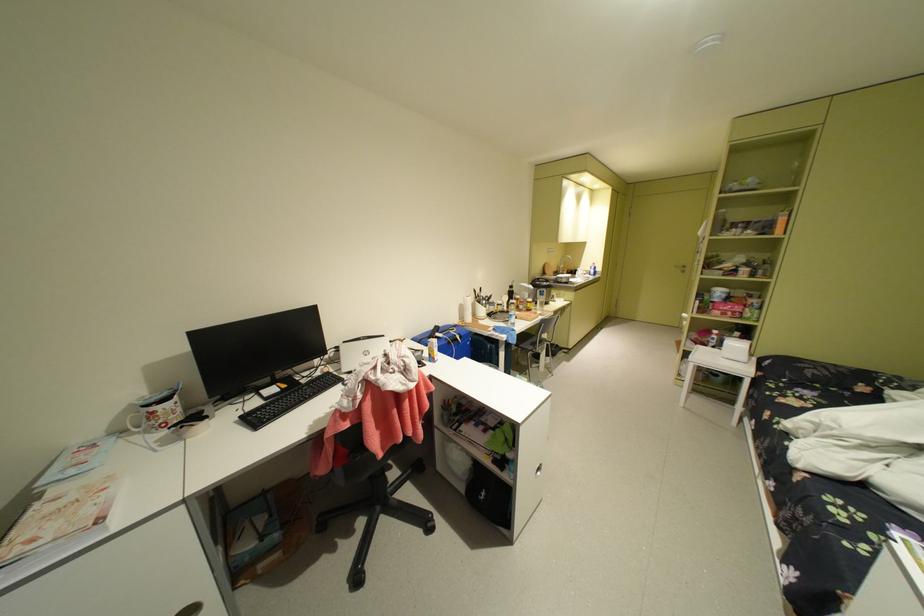
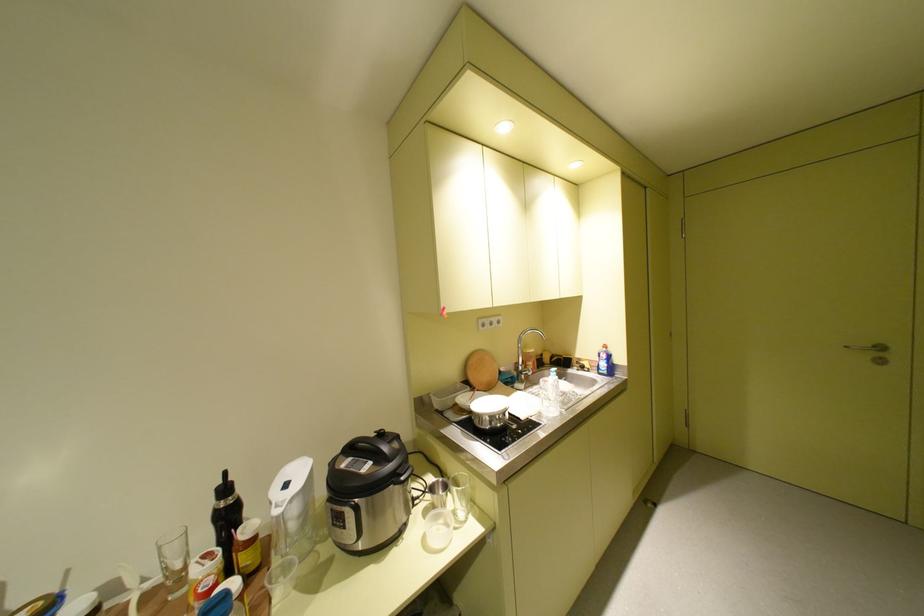
Find the pixel in the second image that matches the point at 599,276 in the first image.

(603, 376)